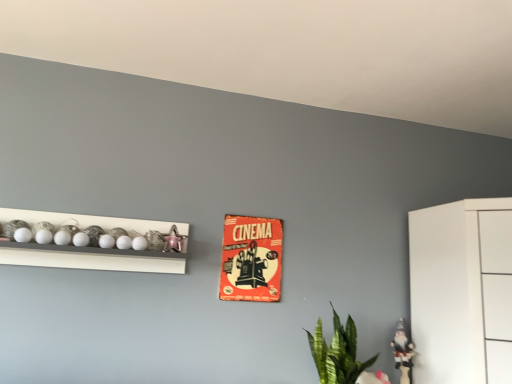
Question: Based on their sizes in the image, would you say green leafy plant at lower right is bigger or smaller than red cardboard cinema poster at center?

Choices:
 (A) small
 (B) big

Answer: (B)

Question: From the image's perspective, is green leafy plant at lower right positioned above or below red cardboard cinema poster at center?

Choices:
 (A) above
 (B) below

Answer: (B)

Question: Considering the real-world distances, which object is farthest from the metallic pink star at upper left, placed as the 2th toy when sorted from right to left?

Choices:
 (A) white glossy shelf at upper left
 (B) green leafy plant at lower right
 (C) red cardboard cinema poster at center
 (D) white glossy gnome at lower right, which ranks as the 1th toy in back-to-front order

Answer: (D)

Question: Which object is the farthest from the metallic pink star at upper left, acting as the first toy starting from the front?

Choices:
 (A) white glossy shelf at upper left
 (B) white glossy gnome at lower right, positioned as the second toy in top-to-bottom order
 (C) green leafy plant at lower right
 (D) red cardboard cinema poster at center

Answer: (B)